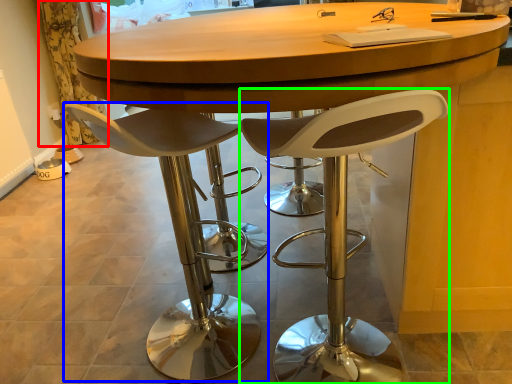
Question: Considering the real-world distances, which object is farthest from curtain (highlighted by a red box)? chair (highlighted by a blue box) or chair (highlighted by a green box)?

Choices:
 (A) chair
 (B) chair

Answer: (B)